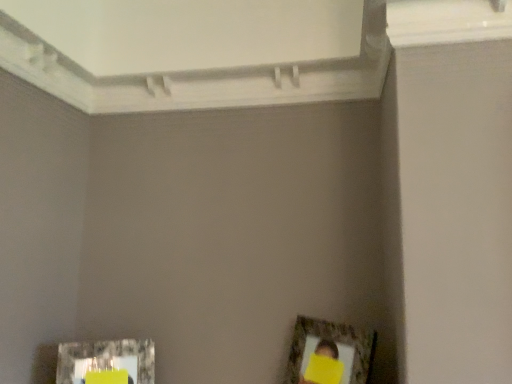
Question: Considering the positions of metallic silver picture frame at lower left, which is counted as the first picture frame, starting from the left, and wooden textured picture frame at lower right, placed as the second picture frame when sorted from left to right, in the image, is metallic silver picture frame at lower left, which is counted as the first picture frame, starting from the left, wider or thinner than wooden textured picture frame at lower right, placed as the second picture frame when sorted from left to right,?

Choices:
 (A) wide
 (B) thin

Answer: (B)

Question: In terms of size, does metallic silver picture frame at lower left, which ranks as the second picture frame in right-to-left order, appear bigger or smaller than wooden textured picture frame at lower right, positioned as the 1th picture frame in right-to-left order?

Choices:
 (A) big
 (B) small

Answer: (B)

Question: Visually, is metallic silver picture frame at lower left, which is counted as the first picture frame, starting from the left, positioned to the left or to the right of wooden textured picture frame at lower right, placed as the second picture frame when sorted from left to right?

Choices:
 (A) right
 (B) left

Answer: (B)

Question: From their relative heights in the image, would you say wooden textured picture frame at lower right, placed as the second picture frame when sorted from left to right, is taller or shorter than metallic silver picture frame at lower left, which is counted as the first picture frame, starting from the left?

Choices:
 (A) short
 (B) tall

Answer: (B)

Question: Considering the positions of point (362, 352) and point (71, 377), is point (362, 352) closer or farther from the camera than point (71, 377)?

Choices:
 (A) closer
 (B) farther

Answer: (A)

Question: Considering their positions, is wooden textured picture frame at lower right, positioned as the 1th picture frame in right-to-left order, located in front of or behind metallic silver picture frame at lower left, which ranks as the second picture frame in right-to-left order?

Choices:
 (A) behind
 (B) front

Answer: (B)

Question: From the image's perspective, relative to metallic silver picture frame at lower left, which ranks as the second picture frame in right-to-left order, is wooden textured picture frame at lower right, positioned as the 1th picture frame in right-to-left order, above or below?

Choices:
 (A) below
 (B) above

Answer: (B)